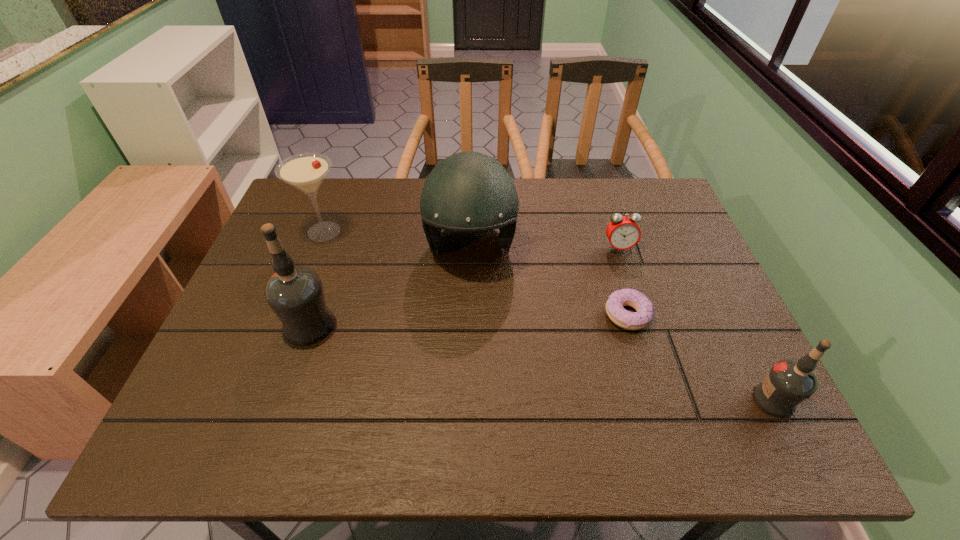
If equal spacing is the goal by inserting an additional vodka among them, please point out a vacant space for this new vodka. Please provide its 2D coordinates. Your answer should be formatted as a tuple, i.e. [(x, y)], where the tuple contains the x and y coordinates of a point satisfying the conditions above.

[(525, 360)]